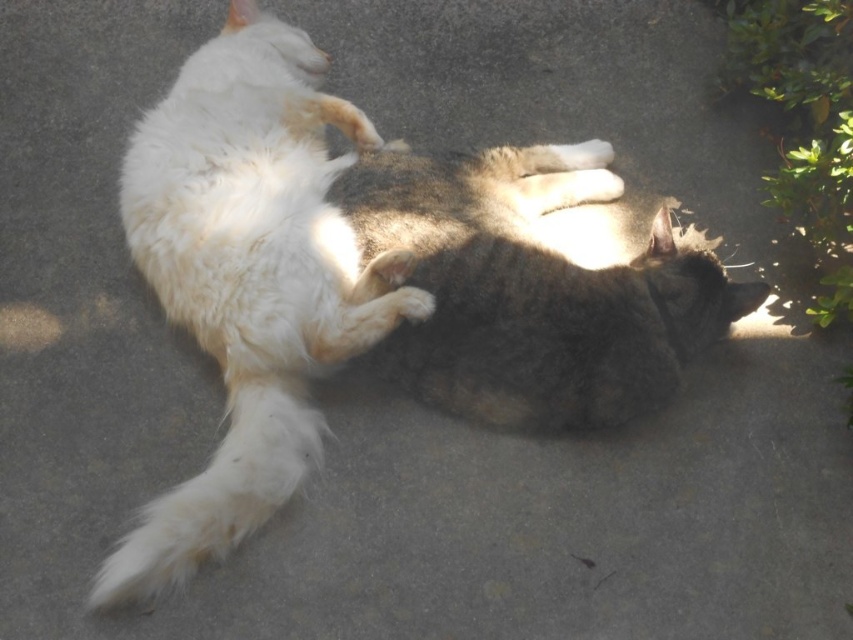
The width and height of the screenshot is (853, 640). Describe the element at coordinates (247, 276) in the screenshot. I see `white fluffy cat at left` at that location.

Is white fluffy cat at left bigger than white fluffy paw at center?

Indeed, white fluffy cat at left has a larger size compared to white fluffy paw at center.

Between point (361, 124) and point (408, 312), which one is positioned behind?

Point (361, 124)

Locate an element on the screen. Image resolution: width=853 pixels, height=640 pixels. white fluffy cat at left is located at coordinates [x=247, y=276].

Is white fluffy cat at left taller than gray-furred cat at center?

Indeed, white fluffy cat at left has a greater height compared to gray-furred cat at center.

Is white fluffy cat at left wider than gray-furred cat at center?

In fact, white fluffy cat at left might be narrower than gray-furred cat at center.

Which is in front, point (335, 324) or point (532, 188)?

Positioned in front is point (335, 324).

What are the coordinates of `white fluffy cat at left` in the screenshot? It's located at (247, 276).

Does gray-furred cat at center appear under white fluffy paw at center?

No, gray-furred cat at center is not below white fluffy paw at center.

The image size is (853, 640). What do you see at coordinates (532, 289) in the screenshot?
I see `gray-furred cat at center` at bounding box center [532, 289].

You are a GUI agent. You are given a task and a screenshot of the screen. Output one action in this format:
    pyautogui.click(x=<x>, y=<y>)
    Task: Click on the gray-furred cat at center
    
    Given the screenshot: What is the action you would take?
    pyautogui.click(x=532, y=289)